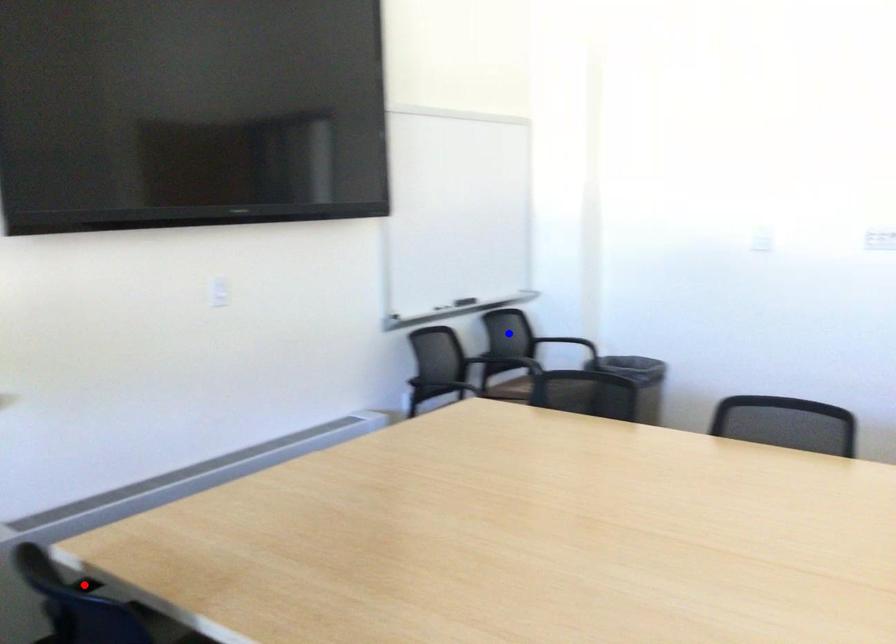
Question: Which of the two points in the image is closer to the camera?

Choices:
 (A) Blue point is closer.
 (B) Red point is closer.

Answer: (B)